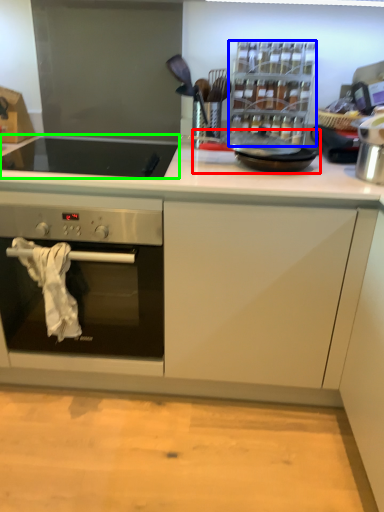
Question: Estimate the real-world distances between objects in this image. Which object is farther from frying pan (highlighted by a red box), appliance (highlighted by a blue box) or gas stove (highlighted by a green box)?

Choices:
 (A) appliance
 (B) gas stove

Answer: (B)